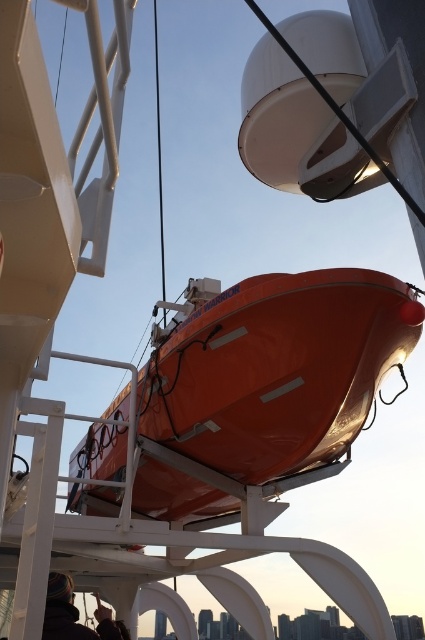
You are a photographer standing at the camera position. You want to take a photo of the orange glossy boat at center. If your camera has a focal length of 50mm and you want to capture the boat in full frame, which requires the boat to be at least 16 feet away from the camera, should you move closer or farther away?

The orange glossy boat at center is currently 14.04 feet from the camera, which is closer than the required 16 feet. To capture the boat in full frame, you need to move farther away to increase the distance to at least 16 feet.

You are standing on the deck of the ship and see two points marked on the lifeboat. The first point is at coordinate point (x=291, y=349) and the second is at point (x=121, y=634). If you were to draw a straight line from your current position to each point, which point would the line reach first?

The line to point (x=291, y=349) would be reached first since it is in front of point (x=121, y=634).

You are a crew member on a ship and need to store a dark brown leather jacket at lower left. The orange glossy boat at center is in the way. Can you lift the jacket over the boat to place it on a shelf behind?

The orange glossy boat at center is taller than the dark brown leather jacket at lower left. Therefore, you cannot lift the jacket over the boat since the boat is taller than the jacket.